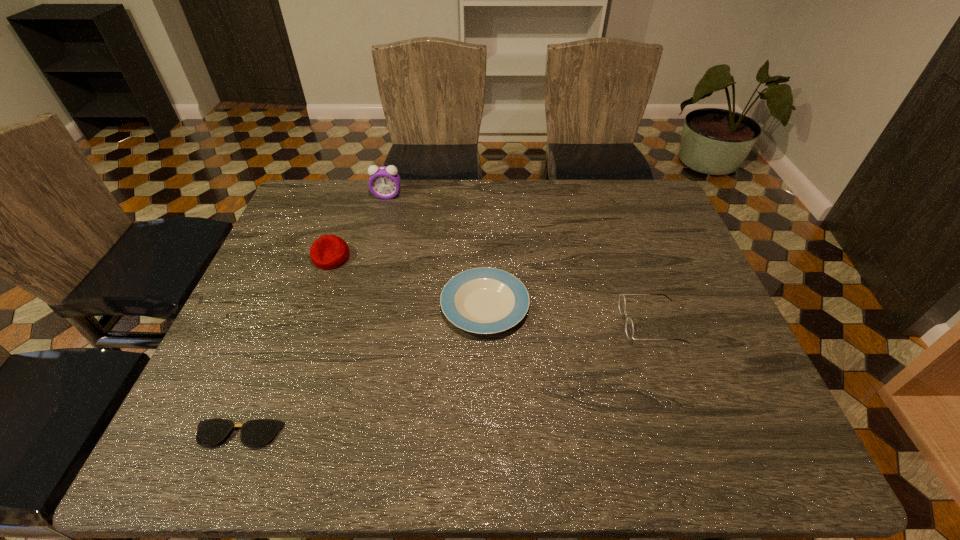
At what (x,y) coordinates should I click in order to perform the action: click on the tallest object. Please return your answer as a coordinate pair (x, y). This screenshot has width=960, height=540. Looking at the image, I should click on (384, 182).

Identify the location of the farthest object. The height and width of the screenshot is (540, 960). pos(384,182).

Find the location of a particular element. This screenshot has width=960, height=540. beanbag is located at coordinates (329, 251).

Find the location of a particular element. This screenshot has height=540, width=960. the second tallest object is located at coordinates (329, 251).

This screenshot has width=960, height=540. Identify the location of the farther spectacles. (629, 327).

Locate an element on the screen. This screenshot has height=540, width=960. the right spectacles is located at coordinates (629, 327).

Identify the location of the second shortest object. (482, 300).

Identify the location of the fourth object from left to right. This screenshot has width=960, height=540. (482, 300).

The height and width of the screenshot is (540, 960). Identify the location of the shortest object. (254, 433).

Find the location of a particular element. The height and width of the screenshot is (540, 960). the nearer spectacles is located at coordinates (254, 433).